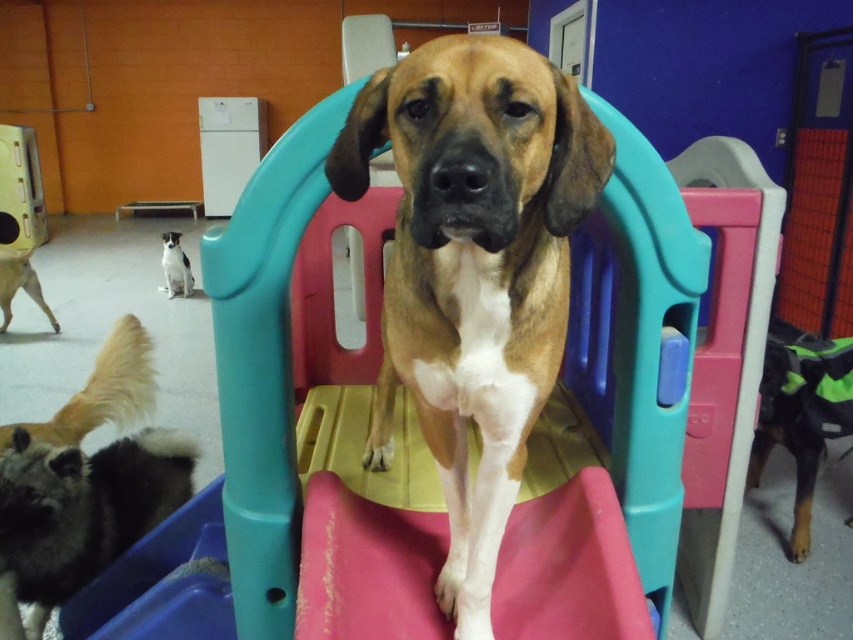
You are a dog owner trying to locate your two dogs in the play area. You see a brown matte dog at center and a golden fur dog at lower left. Which dog is closer to the right side of the play area?

The brown matte dog at center is positioned on the right side of the golden fur dog at lower left, so the brown matte dog at center is closer to the right side of the play area.

You are a dog owner trying to choose between the black and green fabric dog at lower right and the white fur at center for your pet. Based on the size, which one would be more suitable for a larger dog?

The black and green fabric dog at lower right is larger in size than the white fur at center, so it would be more suitable for a larger dog.

You are a dog owner who wants to ensure your new dog can fit through a doorway that is 20 inches tall. Based on the image, which dog between the brown matte dog at center and the golden fur dog at lower left is taller?

The brown matte dog at center is taller than the golden fur dog at lower left, so the golden fur dog at lower left would fit through the doorway since it is shorter.